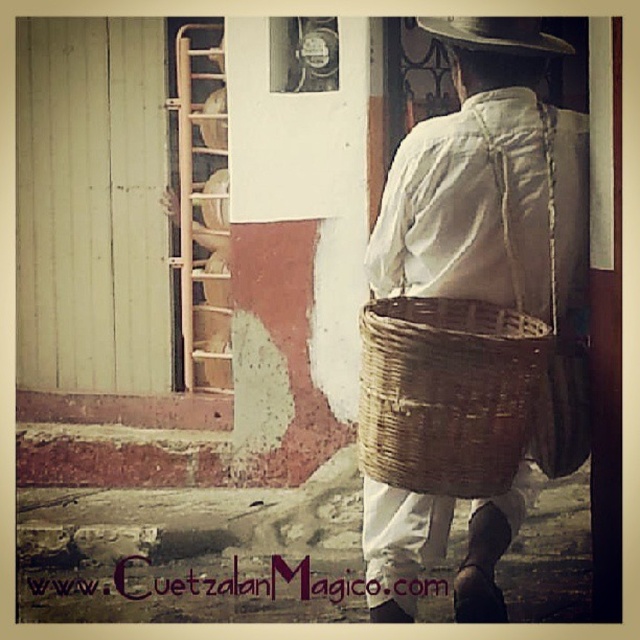
Which is behind, point (502, 205) or point (508, 42)?

Point (508, 42)

The height and width of the screenshot is (640, 640). I want to click on woven straw basket at back, so click(490, 196).

Can you confirm if woven straw basket at back is smaller than woven brown basket at back?

Actually, woven straw basket at back might be larger than woven brown basket at back.

Image resolution: width=640 pixels, height=640 pixels. Describe the element at coordinates (490, 196) in the screenshot. I see `woven straw basket at back` at that location.

I want to click on woven straw basket at back, so click(x=490, y=196).

Is woven brown basket at back wider than brown woven straw hat at upper center?

Correct, the width of woven brown basket at back exceeds that of brown woven straw hat at upper center.

Can you confirm if woven brown basket at back is positioned above brown woven straw hat at upper center?

No, woven brown basket at back is not above brown woven straw hat at upper center.

I want to click on woven brown basket at back, so click(x=448, y=394).

This screenshot has width=640, height=640. I want to click on woven brown basket at back, so click(x=448, y=394).